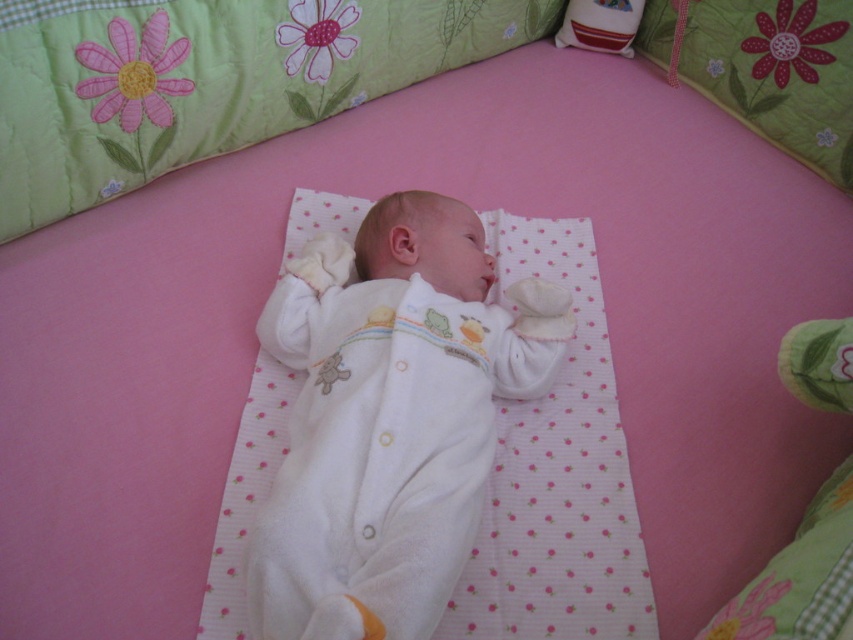
You are a parent trying to place a small toy between the white soft fabric newborn at center and the green quilted pillow at upper center. Based on their sizes, which object should you place the toy closer to?

The white soft fabric newborn at center is much taller than the green quilted pillow at upper center, so you should place the toy closer to the green quilted pillow at upper center to accommodate the newborn.

You are a parent trying to place a baby monitor on the pink surface. The monitor needs to be placed at a specific coordinate point to ensure it captures the baby and the surroundings. The baby is lying on the pink surface, and there are green quilted pillows nearby. Which object is located at the coordinate point (766, 68)?

The point at coordinate (766, 68) marks the location of the green quilted pillow at upper center.